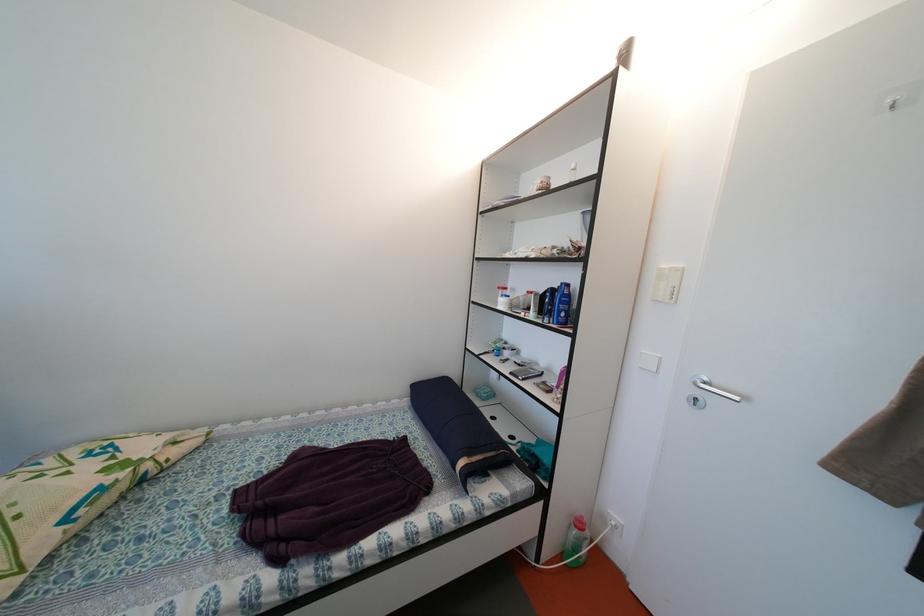
Find where to press the white light switch. Please return your answer as a coordinate pair (x, y).

(666, 284)